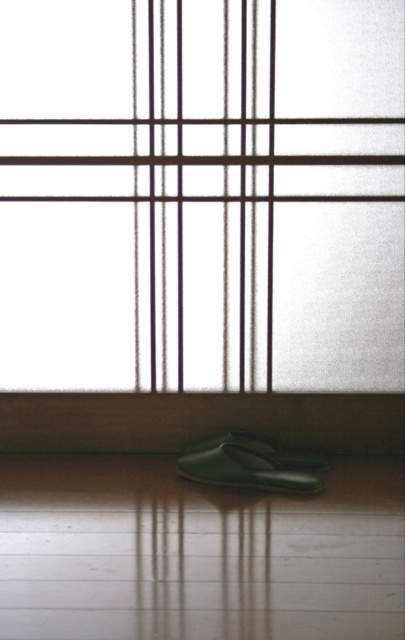
Looking at this image, between green matte slipper at lower center and green matte shoe at lower center, which one is positioned higher?

green matte shoe at lower center

Is green matte slipper at lower center positioned behind green matte shoe at lower center?

No.

Is point (211, 465) positioned behind point (270, 442)?

No, it is not.

This screenshot has width=405, height=640. What are the coordinates of `green matte slipper at lower center` in the screenshot? It's located at [251, 467].

Between point (123, 339) and point (264, 445), which one is positioned behind?

The point (123, 339) is behind.

Between point (211, 180) and point (275, 461), which one is positioned in front?

Positioned in front is point (275, 461).

Where is `frosted glass window at center`? The image size is (405, 640). frosted glass window at center is located at coordinates (202, 195).

Does frosted glass window at center lie behind green matte slipper at lower center?

That is True.

Describe the element at coordinates (202, 195) in the screenshot. I see `frosted glass window at center` at that location.

Identify the location of frosted glass window at center. This screenshot has height=640, width=405. (202, 195).